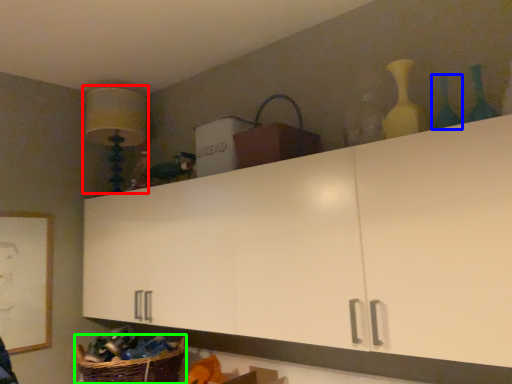
Question: Estimate the real-world distances between objects in this image. Which object is farther from lamp (highlighted by a red box), bottle (highlighted by a blue box) or basket (highlighted by a green box)?

Choices:
 (A) bottle
 (B) basket

Answer: (A)